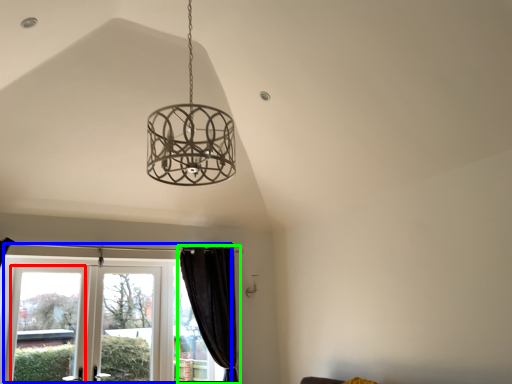
Question: Which is farther away from window (highlighted by a red box)? window (highlighted by a blue box) or curtain (highlighted by a green box)?

Choices:
 (A) window
 (B) curtain

Answer: (B)